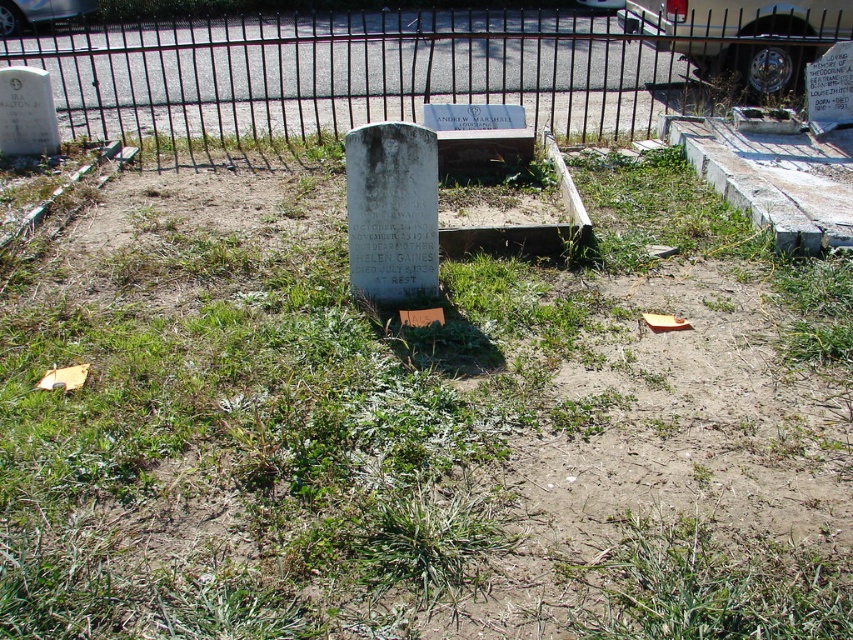
Question: Among these points, which one is farthest from the camera?

Choices:
 (A) (381, 234)
 (B) (598, 104)

Answer: (B)

Question: Is black metal fence at upper center further to the viewer compared to white marble gravestone at center?

Choices:
 (A) no
 (B) yes

Answer: (B)

Question: Is black metal fence at upper center positioned behind white marble gravestone at center?

Choices:
 (A) no
 (B) yes

Answer: (B)

Question: Can you confirm if black metal fence at upper center is wider than white marble gravestone at center?

Choices:
 (A) yes
 (B) no

Answer: (A)

Question: Among these objects, which one is nearest to the camera?

Choices:
 (A) black metal fence at upper center
 (B) white marble gravestone at center

Answer: (B)